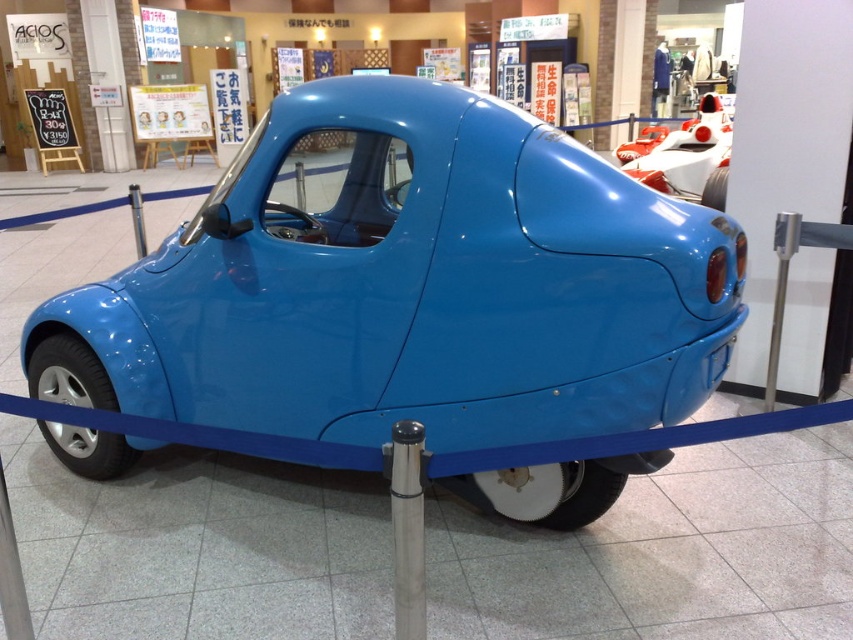
Who is higher up, glossy blue car at center or white glossy race car at upper right?

Result: white glossy race car at upper right is above.

Locate an element on the screen. This screenshot has height=640, width=853. glossy blue car at center is located at coordinates (408, 284).

Who is more forward, (619,416) or (628,164)?

Positioned in front is point (619,416).

Where is `glossy blue car at center`? The image size is (853, 640). glossy blue car at center is located at coordinates pos(408,284).